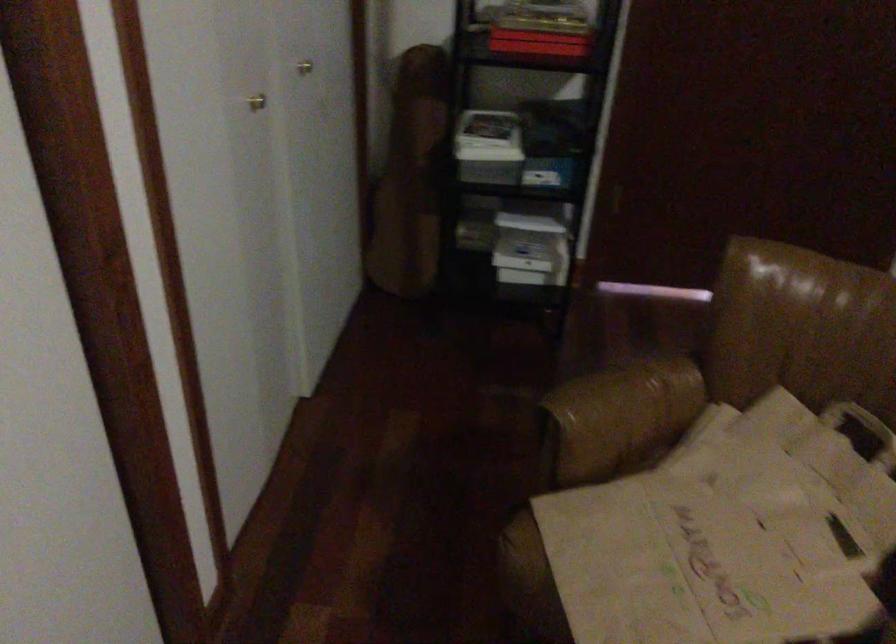
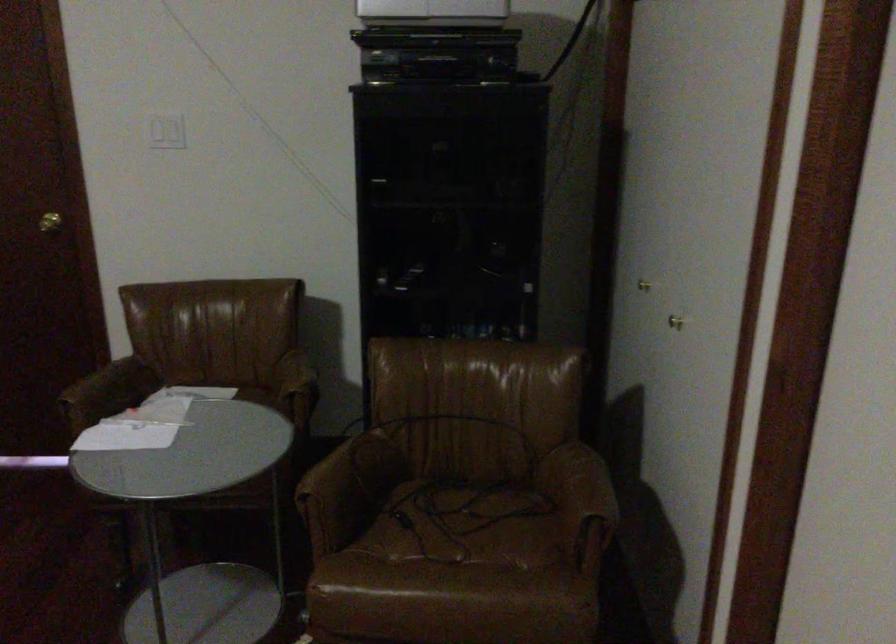
Question: The images are taken continuously from a first-person perspective. In which direction are you moving?

Choices:
 (A) Left
 (B) Right
 (C) Forward
 (D) Backward

Answer: (B)